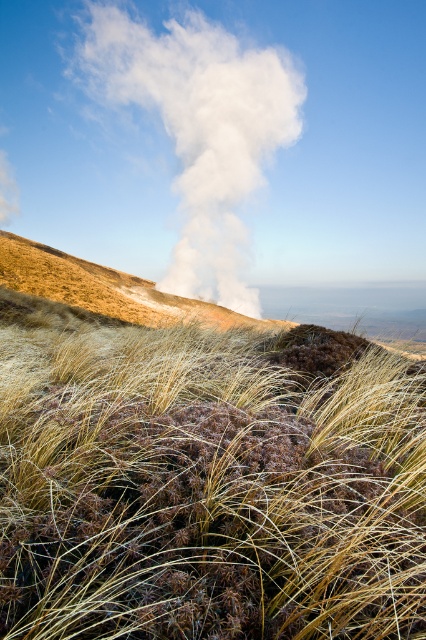
Which is below, white smoke at upper center or brown grassy hillside at center?

brown grassy hillside at center

Which is in front, point (238, 109) or point (52, 250)?

Point (52, 250)

Identify the location of white smoke at upper center. This screenshot has width=426, height=640. (201, 131).

Does dry grass at center lie behind brown grassy hillside at center?

No, dry grass at center is closer to the viewer.

Is dry grass at center closer to the viewer compared to brown grassy hillside at center?

Yes, it is.

Locate an element on the screen. dry grass at center is located at coordinates pos(206,490).

This screenshot has width=426, height=640. Identify the location of dry grass at center. (206, 490).

Between point (222, 474) and point (201, 284), which one is positioned behind?

Positioned behind is point (201, 284).

Identify the location of dry grass at center. This screenshot has width=426, height=640. (206, 490).

This screenshot has height=640, width=426. In order to click on dry grass at center in this screenshot , I will do (206, 490).